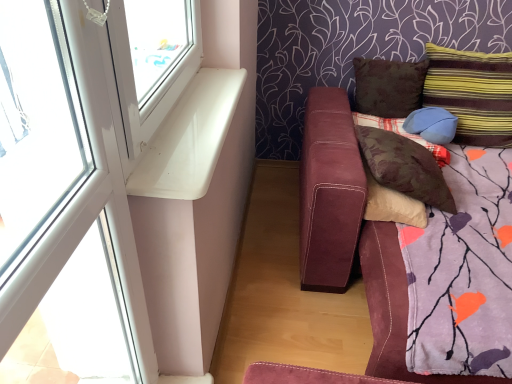
Question: Based on their sizes in the image, would you say white glossy window sill at upper left is bigger or smaller than matte blue pillow at upper right, the 4th pillow when ordered from left to right?

Choices:
 (A) big
 (B) small

Answer: (B)

Question: From the image's perspective, relative to matte blue pillow at upper right, the 4th pillow when ordered from left to right, is white glossy window sill at upper left above or below?

Choices:
 (A) above
 (B) below

Answer: (B)

Question: Estimate the real-world distances between objects in this image. Which object is farther from the brown fabric pillow at center, which is the 5th pillow from right to left?

Choices:
 (A) white glossy window sill at upper left
 (B) brown fabric pillow at upper right, placed as the 4th pillow when sorted from right to left
 (C) white plastic window at upper left
 (D) blue fabric pillow at right, which ranks as the 3th pillow in left-to-right order
 (E) striped fabric pillow at upper right, which ranks as the 5th pillow in left-to-right order

Answer: (C)

Question: Considering the real-world distances, which object is closest to the white plastic window at upper left?

Choices:
 (A) brown fabric pillow at upper right, the 2th pillow in the left-to-right sequence
 (B) white glossy window sill at upper left
 (C) suede-like maroon couch at lower right
 (D) striped fabric pillow at upper right, the first pillow from the right
 (E) matte blue pillow at upper right, the 4th pillow when ordered from left to right

Answer: (B)